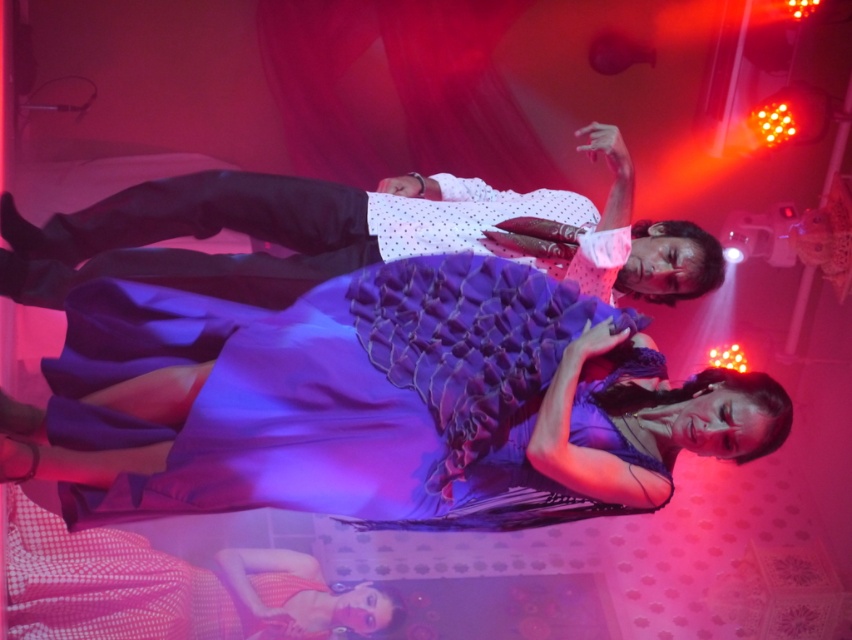
Based on the scene description, which object is taller between the purple tulle dress at center and the matte white shirt at upper center?

The purple tulle dress at center is taller than the matte white shirt at upper center according to the description.

You are a photographer capturing this dance performance. You want to ensure that both the purple tulle dress at center and the matte white shirt at upper center are clearly visible in the photo. Based on their positions, which one is closer to the camera?

The purple tulle dress at center is positioned under the matte white shirt at upper center, so the purple tulle dress at center is closer to the camera than the matte white shirt at upper center.

You are an audience member sitting in the front row of the stage. You want to take a photo of both the purple tulle dress at center and the matte white shirt at upper center. Which one will appear larger in your photo?

The purple tulle dress at center will appear larger in the photo because it is closer to the viewer than the matte white shirt at upper center.